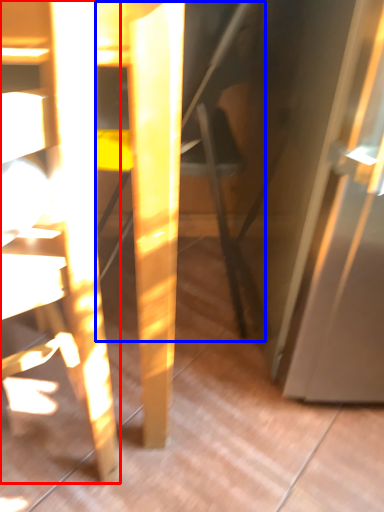
Question: Which point is closer to the camera, chair (highlighted by a red box) or swivel chair (highlighted by a blue box)?

Choices:
 (A) chair
 (B) swivel chair

Answer: (A)